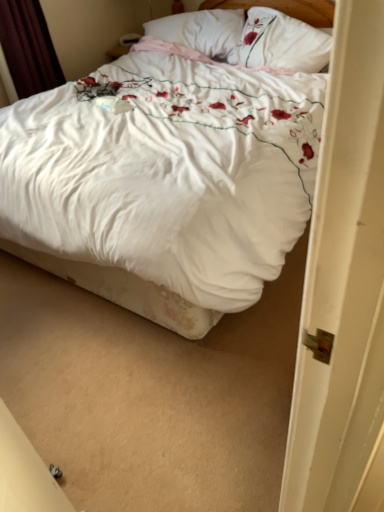
Question: Is white floral duvet at center in front of or behind dark red velvet curtain at upper left in the image?

Choices:
 (A) behind
 (B) front

Answer: (B)

Question: Is white floral duvet at center bigger or smaller than dark red velvet curtain at upper left?

Choices:
 (A) big
 (B) small

Answer: (A)

Question: Based on their relative distances, which object is nearer to the white soft pillow at upper center, which appears as the second pillow when viewed from the right?

Choices:
 (A) white floral duvet at center
 (B) dark red velvet curtain at upper left
 (C) white floral pillow at upper center, which ranks as the second pillow in left-to-right order

Answer: (C)

Question: Which is nearer to the white soft pillow at upper center, which appears as the second pillow when viewed from the right?

Choices:
 (A) white floral pillow at upper center, placed as the first pillow when sorted from right to left
 (B) white floral duvet at center
 (C) dark red velvet curtain at upper left

Answer: (A)